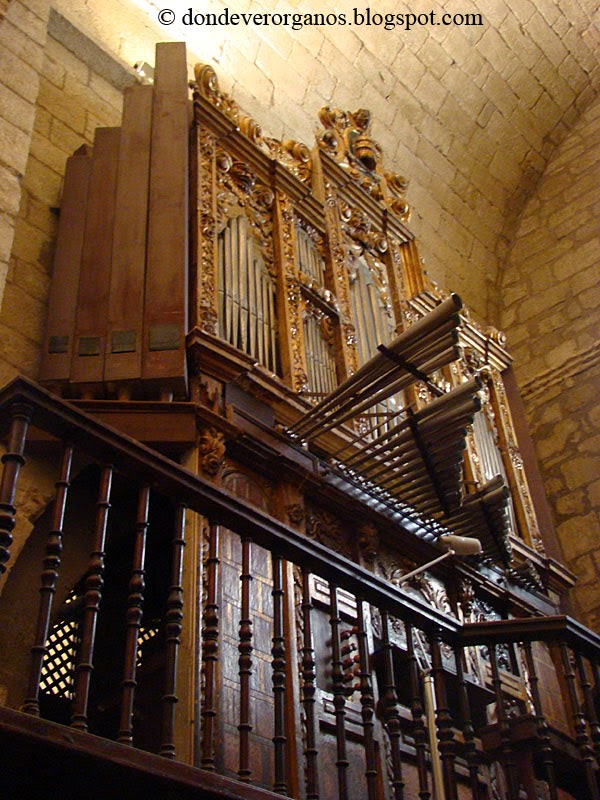
At what (x,y) coordinates should I click in order to perform the action: click on gold wall. Please return your answer as a coordinate pair (x, y). This screenshot has height=800, width=600. Looking at the image, I should click on click(325, 166).